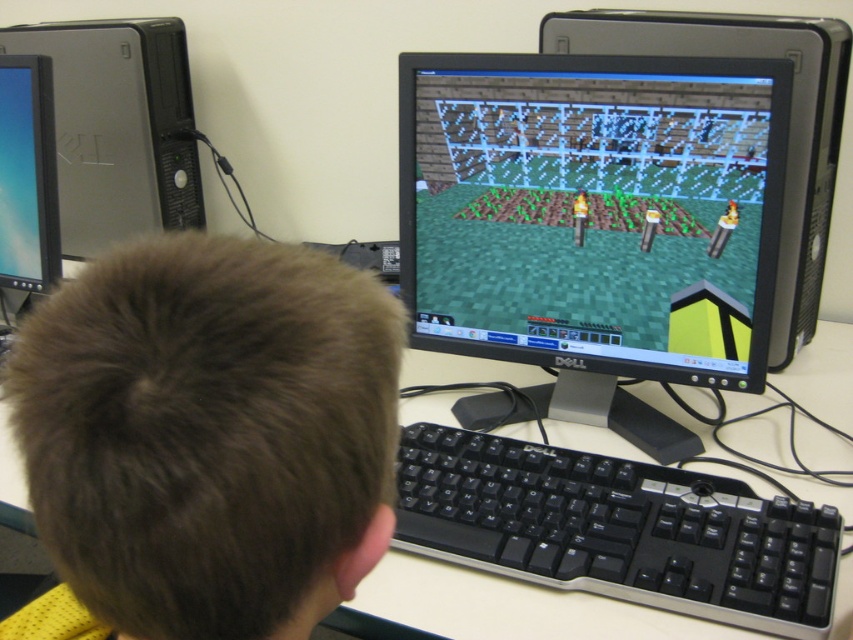
You are setting up a new desk and want to place the black plastic keyboard at center and the matte black monitor at left in a way that they don t block each other. Considering their heights, which object should be placed higher to ensure the keyboard is visible over the monitor?

The matte black monitor at left is taller than the black plastic keyboard at center. To ensure the keyboard is visible over the monitor, the keyboard should be placed on a higher surface or the monitor lowered so its height doesn t obstruct the keyboard.

You are setting up a new monitor and want to place it closer to you than the existing satin silver tower at upper left. Can you position the new monitor closer to you than the existing matte black monitor at left?

The satin silver tower at upper left is already closer to you than the matte black monitor at left. Therefore, you can place the new monitor closer to you than the existing matte black monitor at left by positioning it between the existing tower and your current position.

You are a person who wants to place a new monitor on the desk. The current monitor is at point [213,436]. Is there enough space on the desk to place another monitor?

The point [213,436] marks the white plastic computer desk at center, so yes, there is enough space on the desk to place another monitor since the desk is centered and likely has sufficient space around it.